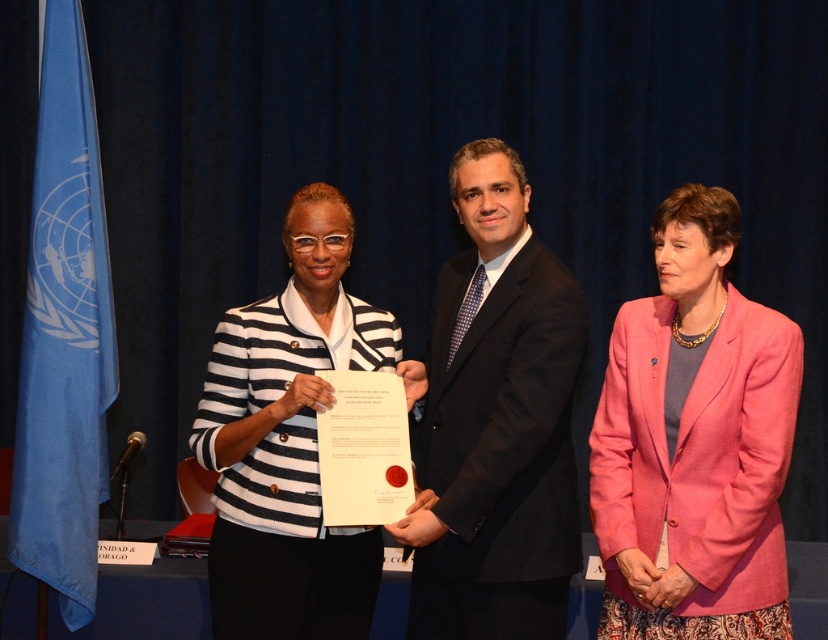
Which is below, pink fabric jacket at center or white striped blazer at center?

Positioned lower is pink fabric jacket at center.

Does point (740, 461) come closer to viewer compared to point (283, 531)?

Yes, it is.

This screenshot has width=828, height=640. I want to click on pink fabric jacket at center, so click(694, 442).

Does black suit at center have a larger size compared to white striped blazer at center?

Correct, black suit at center is larger in size than white striped blazer at center.

The height and width of the screenshot is (640, 828). Describe the element at coordinates (494, 422) in the screenshot. I see `black suit at center` at that location.

Measure the distance between black suit at center and camera.

A distance of 7.12 feet exists between black suit at center and camera.

The image size is (828, 640). In order to click on black suit at center in this screenshot , I will do [x=494, y=422].

Between pink fabric jacket at center and black suit at center, which one appears on the left side from the viewer's perspective?

Positioned to the left is black suit at center.

Can you confirm if pink fabric jacket at center is shorter than black suit at center?

Yes.

Image resolution: width=828 pixels, height=640 pixels. Describe the element at coordinates (694, 442) in the screenshot. I see `pink fabric jacket at center` at that location.

Find the location of a particular element. The image size is (828, 640). pink fabric jacket at center is located at coordinates (694, 442).